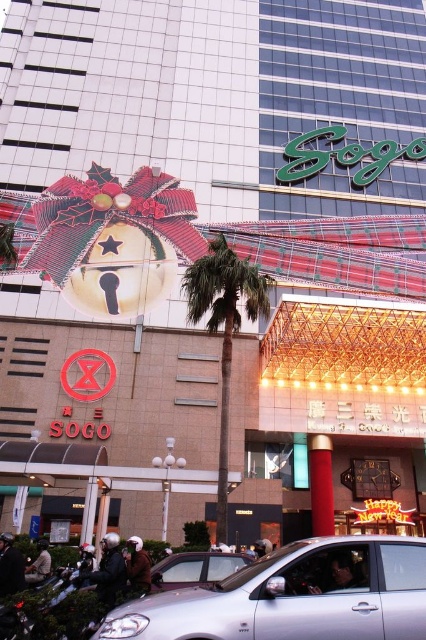
Question: Does silver metallic car at lower center have a smaller size compared to silver metallic car at center?

Choices:
 (A) yes
 (B) no

Answer: (B)

Question: Which object appears closest to the camera in this image?

Choices:
 (A) silver metallic car at lower center
 (B) silver metallic car at center
 (C) green leafy palm tree at center

Answer: (A)

Question: Which of the following is the farthest from the observer?

Choices:
 (A) silver metallic car at center
 (B) green leafy palm tree at center

Answer: (B)

Question: Does silver metallic car at lower center appear under green leafy palm tree at center?

Choices:
 (A) yes
 (B) no

Answer: (A)

Question: Does silver metallic car at lower center have a lesser width compared to green leafy palm tree at center?

Choices:
 (A) no
 (B) yes

Answer: (A)

Question: Which of the following is the closest to the observer?

Choices:
 (A) (333, 625)
 (B) (239, 296)
 (C) (213, 561)

Answer: (A)